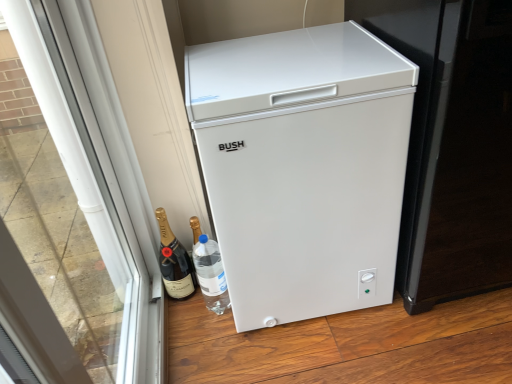
Question: Does point pos(211,104) appear closer or farther from the camera than point pos(122,160)?

Choices:
 (A) closer
 (B) farther

Answer: (A)

Question: From the image's perspective, is white matte refrigerator at center above or below transparent glass door at left?

Choices:
 (A) above
 (B) below

Answer: (A)

Question: Based on their relative distances, which object is farther from the white plastic freezer at right?

Choices:
 (A) transparent glass door at left
 (B) black glass bottle at lower left
 (C) white matte refrigerator at center

Answer: (A)

Question: Which is farther from the white matte refrigerator at center?

Choices:
 (A) black glass bottle at lower left
 (B) white plastic freezer at right
 (C) transparent glass door at left

Answer: (C)